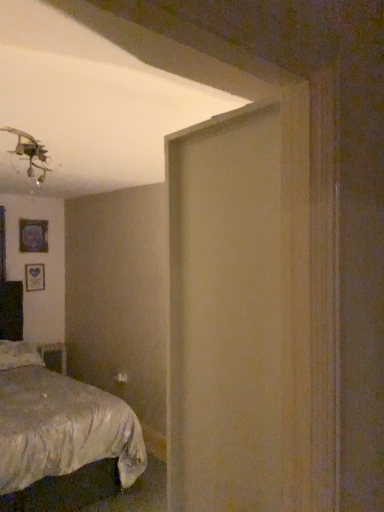
Question: From a real-world perspective, is wooden picture frame at left, which appears as the first picture frame when ordered from the bottom, beneath wooden table at lower left?

Choices:
 (A) no
 (B) yes

Answer: (A)

Question: Considering the relative positions of wooden picture frame at left, which appears as the first picture frame when ordered from the bottom, and wooden table at lower left in the image provided, is wooden picture frame at left, which appears as the first picture frame when ordered from the bottom, to the right of wooden table at lower left from the viewer's perspective?

Choices:
 (A) yes
 (B) no

Answer: (B)

Question: Is wooden picture frame at left, which is the second picture frame in top-to-bottom order, shorter than wooden table at lower left?

Choices:
 (A) yes
 (B) no

Answer: (B)

Question: Considering the relative sizes of wooden picture frame at left, which is the second picture frame in top-to-bottom order, and wooden table at lower left in the image provided, is wooden picture frame at left, which is the second picture frame in top-to-bottom order, wider than wooden table at lower left?

Choices:
 (A) no
 (B) yes

Answer: (A)

Question: Is wooden picture frame at left, which appears as the first picture frame when ordered from the bottom, oriented towards wooden table at lower left?

Choices:
 (A) no
 (B) yes

Answer: (A)

Question: Is wooden picture frame at left, which is the second picture frame in top-to-bottom order, in contact with wooden table at lower left?

Choices:
 (A) no
 (B) yes

Answer: (A)

Question: Does silky white bed at lower left have a lesser height compared to wooden picture frame at left, which appears as the first picture frame when ordered from the bottom?

Choices:
 (A) yes
 (B) no

Answer: (B)

Question: Can you confirm if silky white bed at lower left is wider than wooden picture frame at left, which appears as the first picture frame when ordered from the bottom?

Choices:
 (A) yes
 (B) no

Answer: (A)

Question: Is silky white bed at lower left located outside wooden picture frame at left, which is the second picture frame in top-to-bottom order?

Choices:
 (A) no
 (B) yes

Answer: (B)

Question: Is silky white bed at lower left aimed at wooden picture frame at left, which appears as the first picture frame when ordered from the bottom?

Choices:
 (A) no
 (B) yes

Answer: (A)

Question: Would you say silky white bed at lower left contains wooden picture frame at left, which is the second picture frame in top-to-bottom order?

Choices:
 (A) no
 (B) yes

Answer: (A)

Question: Can you confirm if silky white bed at lower left is thinner than wooden picture frame at left, which is the second picture frame in top-to-bottom order?

Choices:
 (A) no
 (B) yes

Answer: (A)

Question: Is silky white bed at lower left thinner than matte black picture frame at upper left, the first picture frame from the top?

Choices:
 (A) no
 (B) yes

Answer: (A)